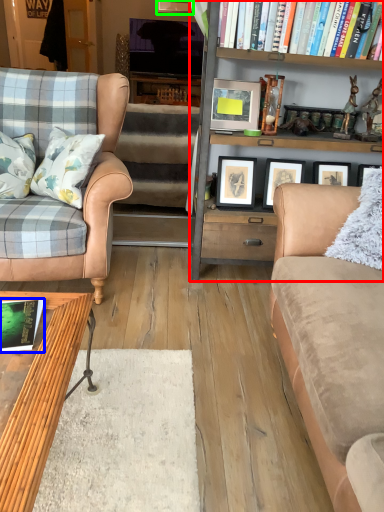
Question: Which is farther away from bookcase (highlighted by a red box)? book (highlighted by a blue box) or picture frame (highlighted by a green box)?

Choices:
 (A) book
 (B) picture frame

Answer: (B)